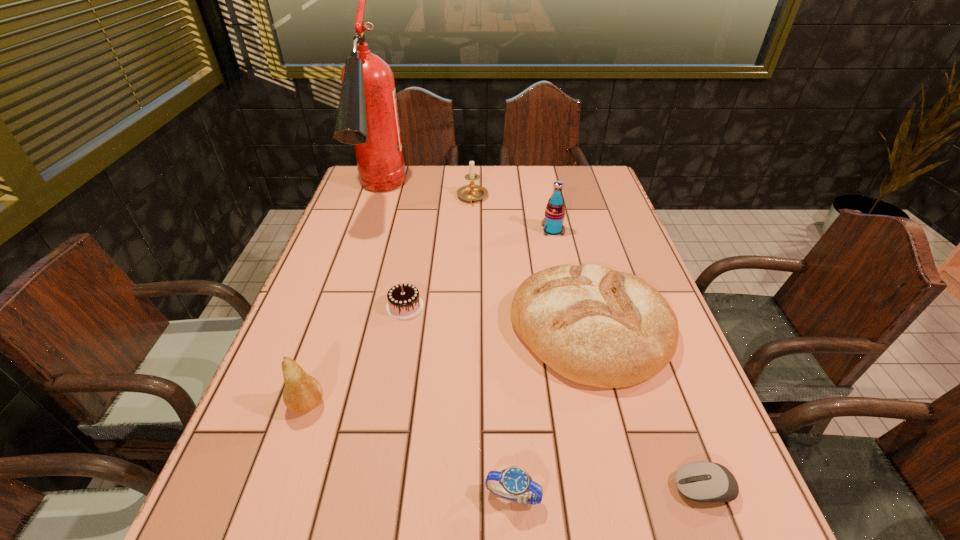
The height and width of the screenshot is (540, 960). Identify the location of fire extinguisher. (367, 117).

Find the location of `soda`. soda is located at coordinates (x=552, y=224).

What are the coordinates of `candle holder` in the screenshot? It's located at (471, 192).

At what (x,y) coordinates should I click in order to perform the action: click on pear. Please return your answer as a coordinate pair (x, y). Looking at the image, I should click on (302, 393).

Where is `the fourth shortest object`? This screenshot has width=960, height=540. the fourth shortest object is located at coordinates (596, 326).

Where is `chocolate cake`? This screenshot has height=540, width=960. chocolate cake is located at coordinates (404, 302).

Locate an element on the screen. The image size is (960, 540). the third object from left to right is located at coordinates (404, 302).

You are a GUI agent. You are given a task and a screenshot of the screen. Output one action in this format:
    pyautogui.click(x=<x>, y=<y>)
    Task: Click on the seventh tallest object
    
    Given the screenshot: What is the action you would take?
    pyautogui.click(x=516, y=483)

Locate an element on the screen. This screenshot has height=540, width=960. the shortest object is located at coordinates (705, 482).

The image size is (960, 540). I want to click on vacant region located 0.340m at the nozzle end of the fire extinguisher, so click(338, 320).